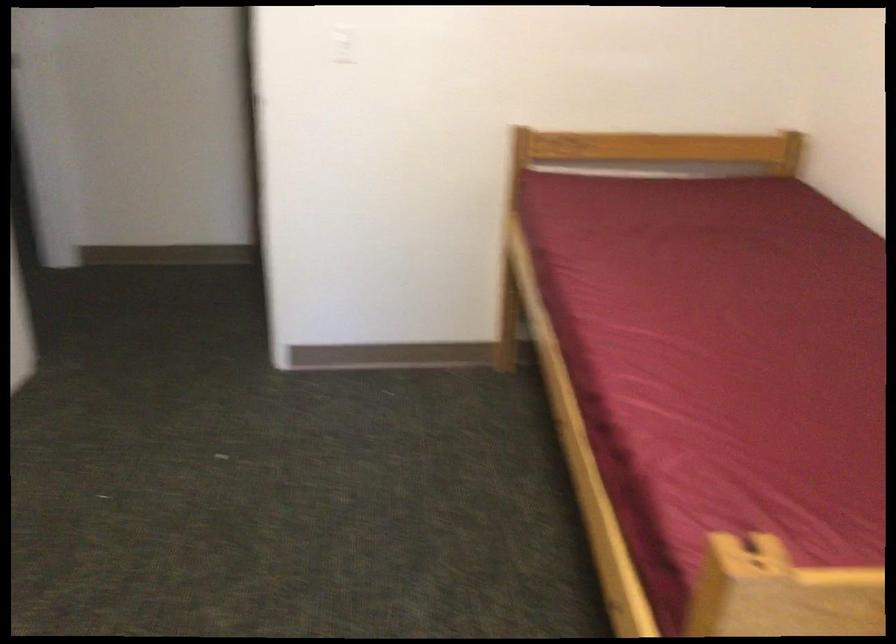
This screenshot has height=644, width=896. What do you see at coordinates (805, 603) in the screenshot?
I see `the bed footboard` at bounding box center [805, 603].